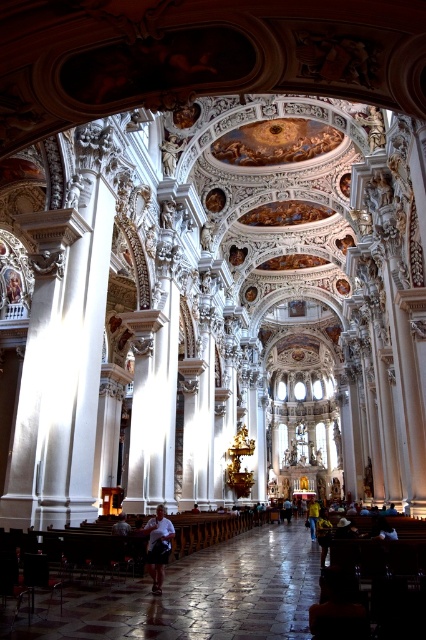
Can you confirm if white matte shirt at center is wider than yellow shirt at center?

No, white matte shirt at center is not wider than yellow shirt at center.

Can you confirm if white matte shirt at center is smaller than yellow shirt at center?

Indeed, white matte shirt at center has a smaller size compared to yellow shirt at center.

Identify the location of white matte shirt at center. (158, 545).

The width and height of the screenshot is (426, 640). What do you see at coordinates (158, 545) in the screenshot? I see `white matte shirt at center` at bounding box center [158, 545].

Does white matte shirt at center come behind light brown leather jacket at center?

No, white matte shirt at center is closer to the viewer.

Locate an element on the screen. white matte shirt at center is located at coordinates (158, 545).

Can you confirm if yellow shirt at center is positioned above light brown leather jacket at center?

Correct, yellow shirt at center is located above light brown leather jacket at center.

Between point (313, 518) and point (290, 513), which one is positioned in front?

Point (313, 518) is more forward.

Where is `yellow shirt at center`? The height and width of the screenshot is (640, 426). yellow shirt at center is located at coordinates (313, 516).